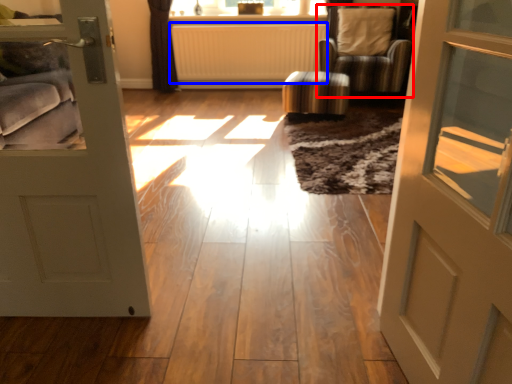
Question: Which object appears farthest to the camera in this image, chair (highlighted by a red box) or radiator (highlighted by a blue box)?

Choices:
 (A) chair
 (B) radiator

Answer: (B)